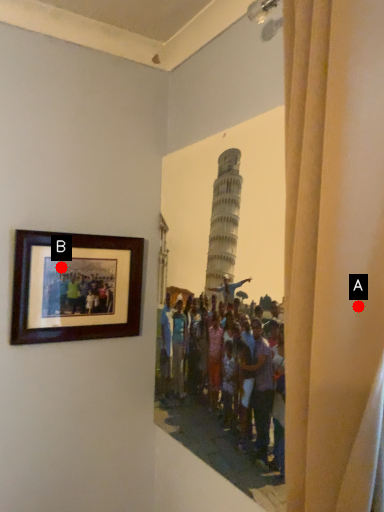
Question: Two points are circled on the image, labeled by A and B beside each circle. Which of the following is the farthest from the observer?

Choices:
 (A) A is further
 (B) B is further

Answer: (B)